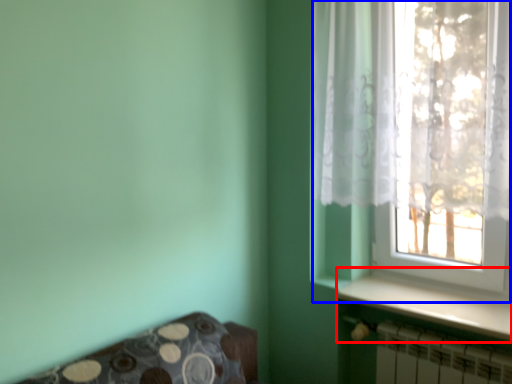
Question: Which object is further to the camera taking this photo, window sill (highlighted by a red box) or window (highlighted by a blue box)?

Choices:
 (A) window sill
 (B) window

Answer: (A)